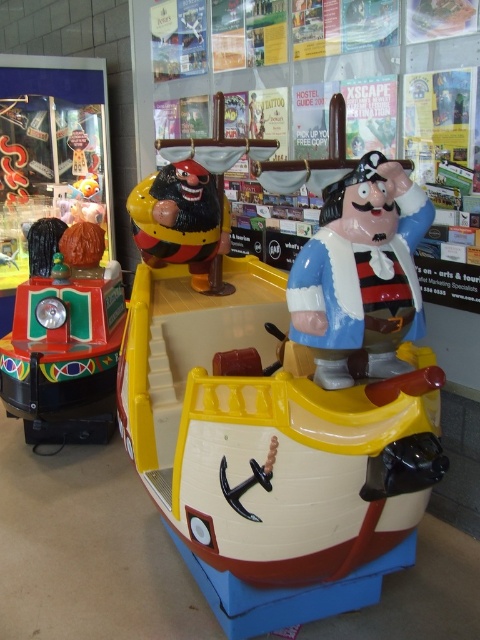
Does shiny plastic pirate at center appear under shiny green plastic train at left?

Incorrect, shiny plastic pirate at center is not positioned below shiny green plastic train at left.

Looking at this image, which is more to the right, shiny plastic pirate at center or shiny green plastic train at left?

Positioned to the right is shiny plastic pirate at center.

Between point (382, 378) and point (58, 256), which one is positioned in front?

Point (382, 378) is in front.

Find the location of a particular element. shiny plastic pirate at center is located at coordinates (360, 273).

Is shiny plastic pirate ship at center bigger than shiny plastic pirate at center?

Yes, shiny plastic pirate ship at center is bigger than shiny plastic pirate at center.

Who is taller, shiny plastic pirate ship at center or shiny plastic pirate at center?

shiny plastic pirate ship at center

Does point (352, 288) lie behind point (343, 209)?

No, it is not.

Locate an element on the screen. Image resolution: width=480 pixels, height=640 pixels. shiny plastic pirate ship at center is located at coordinates pyautogui.click(x=291, y=401).

Does shiny plastic pirate ship at center appear under shiny green plastic train at left?

Actually, shiny plastic pirate ship at center is above shiny green plastic train at left.

Is point (323, 596) positioned behind point (40, 394)?

No, (323, 596) is in front of (40, 394).

The image size is (480, 640). In order to click on shiny plastic pirate ship at center in this screenshot , I will do `click(291, 401)`.

Identify the location of shiny plastic pirate ship at center. This screenshot has width=480, height=640. (291, 401).